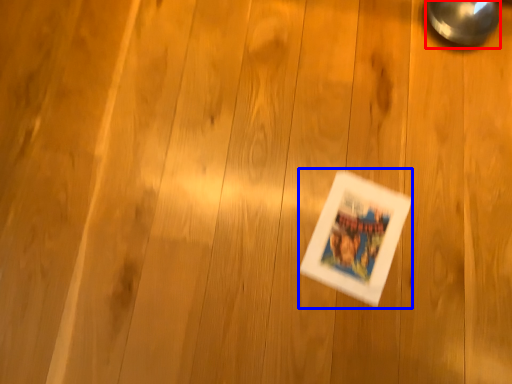
Question: Among these objects, which one is nearest to the camera, magnifying glass (highlighted by a red box) or comic book (highlighted by a blue box)?

Choices:
 (A) magnifying glass
 (B) comic book

Answer: (B)